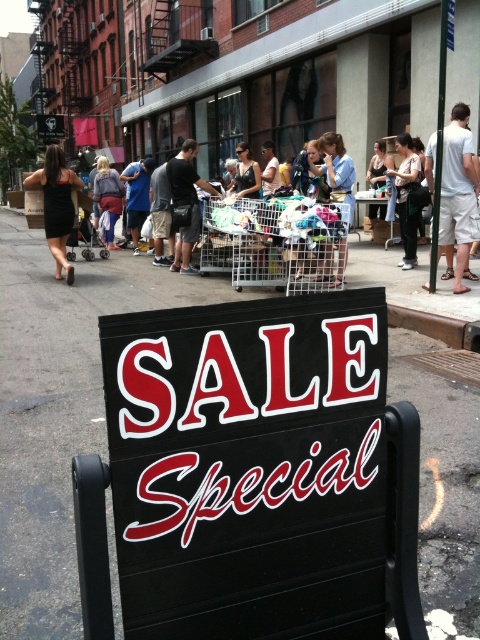
Question: Which object is closer to the camera taking this photo?

Choices:
 (A) light brown leather jacket at center
 (B) black dress at left

Answer: (B)

Question: Which object is closer to the camera taking this photo?

Choices:
 (A) black asphalt at center
 (B) black dress at left
 (C) denim jacket at center

Answer: (A)

Question: Is black asphalt at center smaller than light brown leather jacket at center?

Choices:
 (A) yes
 (B) no

Answer: (B)

Question: Where is black asphalt at center located in relation to denim jacket at center in the image?

Choices:
 (A) above
 (B) below

Answer: (B)

Question: Is black asphalt at center below light brown leather jacket at center?

Choices:
 (A) yes
 (B) no

Answer: (A)

Question: Considering the real-world distances, which object is farthest from the black asphalt at center?

Choices:
 (A) black dress at left
 (B) light brown leather jacket at center

Answer: (B)